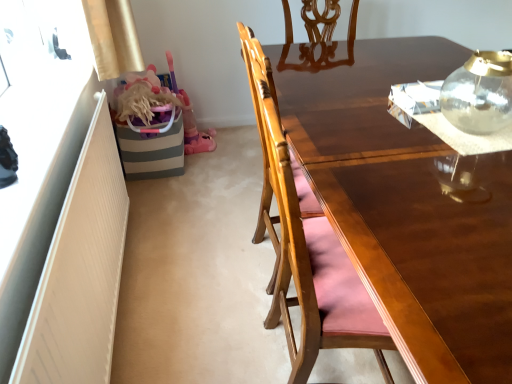
Measure the distance between point (504, 108) and camera.

4.49 feet.

I want to click on transparent glass teapot at upper right, so [x=479, y=93].

The height and width of the screenshot is (384, 512). What do you see at coordinates (479, 93) in the screenshot?
I see `transparent glass teapot at upper right` at bounding box center [479, 93].

Find the location of a particular element. This screenshot has height=384, width=512. wooden chair at center is located at coordinates (305, 245).

What do you see at coordinates (305, 245) in the screenshot? I see `wooden chair at center` at bounding box center [305, 245].

Find the location of a particular element. transparent glass teapot at upper right is located at coordinates point(479,93).

Does wooden chair at center appear on the left side of transparent glass teapot at upper right?

Indeed, wooden chair at center is positioned on the left side of transparent glass teapot at upper right.

Does wooden chair at center lie in front of transparent glass teapot at upper right?

No, the depth of wooden chair at center is greater than that of transparent glass teapot at upper right.

Is point (292, 203) closer or farther from the camera than point (485, 71)?

Point (292, 203).

Based on the photo, from the image's perspective, who appears lower, wooden chair at center or transparent glass teapot at upper right?

wooden chair at center is shown below in the image.

From a real-world perspective, is wooden chair at center located higher than transparent glass teapot at upper right?

No.

Considering the sizes of objects wooden chair at center and transparent glass teapot at upper right in the image provided, who is thinner, wooden chair at center or transparent glass teapot at upper right?

Thinner between the two is transparent glass teapot at upper right.

Which of these two, wooden chair at center or transparent glass teapot at upper right, stands taller?

With more height is wooden chair at center.

In the scene shown: Between wooden chair at center and transparent glass teapot at upper right, which one has smaller size?

transparent glass teapot at upper right.

Is transparent glass teapot at upper right surrounded by wooden chair at center?

That's incorrect, transparent glass teapot at upper right is not inside wooden chair at center.

Is wooden chair at center directly adjacent to transparent glass teapot at upper right?

No, wooden chair at center is not in contact with transparent glass teapot at upper right.

Is wooden chair at center turned away from transparent glass teapot at upper right?

No, wooden chair at center's orientation is not away from transparent glass teapot at upper right.

What's the angular difference between wooden chair at center and transparent glass teapot at upper right's facing directions?

The angle between the facing direction of wooden chair at center and the facing direction of transparent glass teapot at upper right is 94.2 degrees.

Measure the distance from wooden chair at center to transparent glass teapot at upper right.

wooden chair at center is 25.50 inches from transparent glass teapot at upper right.

Locate an element on the screen. chair directly beneath the transparent glass teapot at upper right (from a real-world perspective) is located at coordinates (305, 245).

Considering the positions of objects transparent glass teapot at upper right and wooden chair at center in the image provided, who is more to the right, transparent glass teapot at upper right or wooden chair at center?

Positioned to the right is transparent glass teapot at upper right.

Considering their positions, is transparent glass teapot at upper right located in front of or behind wooden chair at center?

Visually, transparent glass teapot at upper right is located in front of wooden chair at center.

Is point (489, 55) positioned behind point (311, 337)?

Yes, it is.

From the image's perspective, is transparent glass teapot at upper right located beneath wooden chair at center?

No, from the image's perspective, transparent glass teapot at upper right is not below wooden chair at center.

From a real-world perspective, which is physically below, transparent glass teapot at upper right or wooden chair at center?

wooden chair at center.

Between transparent glass teapot at upper right and wooden chair at center, which one has smaller width?

With smaller width is transparent glass teapot at upper right.

Can you confirm if transparent glass teapot at upper right is taller than wooden chair at center?

No, transparent glass teapot at upper right is not taller than wooden chair at center.

Which of these two, transparent glass teapot at upper right or wooden chair at center, is smaller?

With smaller size is transparent glass teapot at upper right.

Is transparent glass teapot at upper right inside the boundaries of wooden chair at center, or outside?

transparent glass teapot at upper right is not enclosed by wooden chair at center.

Is transparent glass teapot at upper right next to wooden chair at center?

transparent glass teapot at upper right and wooden chair at center are clearly separated.

Is transparent glass teapot at upper right positioned with its back to wooden chair at center?

No, transparent glass teapot at upper right is not facing the opposite direction of wooden chair at center.

Locate an element on the screen. The height and width of the screenshot is (384, 512). chair behind the transparent glass teapot at upper right is located at coordinates (305, 245).

Find the location of `chair below the transparent glass teapot at upper right (from the image's perspective)`. chair below the transparent glass teapot at upper right (from the image's perspective) is located at coordinates (305, 245).

Image resolution: width=512 pixels, height=384 pixels. Find the location of `chair that is on the left side of transparent glass teapot at upper right`. chair that is on the left side of transparent glass teapot at upper right is located at coordinates (305, 245).